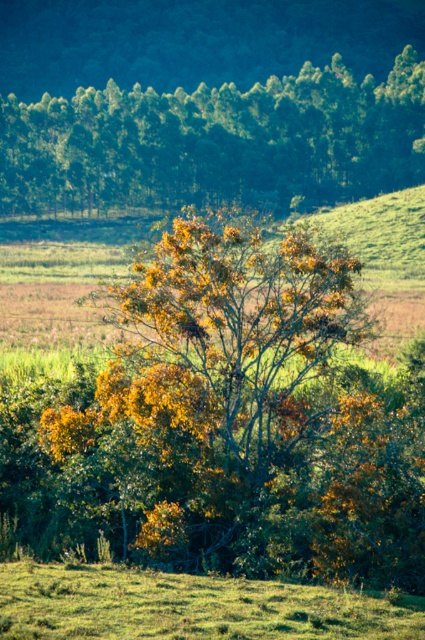
Question: Among these points, which one is farthest from the camera?

Choices:
 (A) (172, 161)
 (B) (323, 627)

Answer: (A)

Question: Does yellow-green leafy tree at upper center appear under green grass at lower center?

Choices:
 (A) yes
 (B) no

Answer: (B)

Question: Can you confirm if yellow-green leafy tree at upper center is positioned to the right of green grass at lower center?

Choices:
 (A) no
 (B) yes

Answer: (A)

Question: Which point is farther to the camera?

Choices:
 (A) yellow-green leafy tree at upper center
 (B) green grass at lower center

Answer: (A)

Question: From the image, what is the correct spatial relationship of yellow-green leafy tree at upper center in relation to green grass at lower center?

Choices:
 (A) below
 (B) above

Answer: (B)